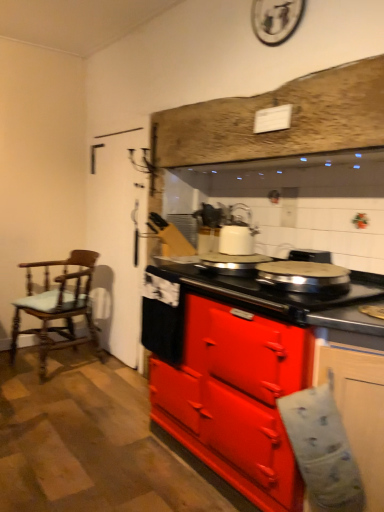
Locate an element on the screen. This screenshot has height=512, width=384. matte red stove at center, acting as the first cabinetry starting from the back is located at coordinates (236, 398).

This screenshot has height=512, width=384. What are the coordinates of `wooden chair with cushion at left` in the screenshot? It's located at (58, 306).

This screenshot has width=384, height=512. Describe the element at coordinates (359, 409) in the screenshot. I see `matte white cabinet at lower right, placed as the second cabinetry when sorted from back to front` at that location.

You are a GUI agent. You are given a task and a screenshot of the screen. Output one action in this format:
    pyautogui.click(x=<x>, y=<y>)
    Task: Click on the matte red stove at center, acting as the first cabinetry starting from the back
    
    Given the screenshot: What is the action you would take?
    pyautogui.click(x=236, y=398)

The width and height of the screenshot is (384, 512). What are the coordinates of `cabinetry above the matte white cabinet at lower right, which is the first cabinetry from front to back (from a real-world perspective)` in the screenshot? It's located at (236, 398).

Looking at this image, is matte white cabinet at lower right, placed as the second cabinetry when sorted from back to front, positioned with its back to matte red stove at center, acting as the first cabinetry starting from the back?

Yes.

Does point (379, 384) come behind point (259, 438)?

That is False.

From a real-world perspective, is matte white cabinet at lower right, placed as the second cabinetry when sorted from back to front, physically below matte red stove at center, acting as the first cabinetry starting from the back?

Yes.

From the image's perspective, is wooden chair with cushion at left located above matte red stove at center, acting as the first cabinetry starting from the back?

Indeed, from the image's perspective, wooden chair with cushion at left is shown above matte red stove at center, acting as the first cabinetry starting from the back.

Choose the correct answer: Is wooden chair with cushion at left inside matte red stove at center, positioned as the 2th cabinetry in front-to-back order, or outside it?

wooden chair with cushion at left lies outside matte red stove at center, positioned as the 2th cabinetry in front-to-back order.

Consider the image. In the image, is wooden chair with cushion at left positioned in front of or behind matte red stove at center, acting as the first cabinetry starting from the back?

wooden chair with cushion at left is behind matte red stove at center, acting as the first cabinetry starting from the back.

Would you say white glossy kettle at center is a long distance from matte white cabinet at lower right, placed as the second cabinetry when sorted from back to front?

Yes, white glossy kettle at center is far from matte white cabinet at lower right, placed as the second cabinetry when sorted from back to front.

From the image's perspective, which object appears higher, white glossy kettle at center or matte white cabinet at lower right, which is the first cabinetry from front to back?

From the image's view, white glossy kettle at center is above.

Is white glossy kettle at center bigger or smaller than matte white cabinet at lower right, placed as the second cabinetry when sorted from back to front?

Clearly, white glossy kettle at center is smaller in size than matte white cabinet at lower right, placed as the second cabinetry when sorted from back to front.

Considering the positions of objects white glossy kettle at center and matte white cabinet at lower right, which is the first cabinetry from front to back, in the image provided, who is behind, white glossy kettle at center or matte white cabinet at lower right, which is the first cabinetry from front to back,?

white glossy kettle at center is further from the camera.

Is the position of matte white cabinet at lower right, placed as the second cabinetry when sorted from back to front, more distant than that of white glossy kettle at center?

No, it is not.

From the image's perspective, does matte white cabinet at lower right, placed as the second cabinetry when sorted from back to front, appear higher than white glossy kettle at center?

Actually, matte white cabinet at lower right, placed as the second cabinetry when sorted from back to front, appears below white glossy kettle at center in the image.

Which of these two, matte white cabinet at lower right, placed as the second cabinetry when sorted from back to front, or white glossy kettle at center, is thinner?

white glossy kettle at center.

From a real-world perspective, is matte white cabinet at lower right, which is the first cabinetry from front to back, positioned above or below white glossy kettle at center?

From a real-world perspective, matte white cabinet at lower right, which is the first cabinetry from front to back, is physically below white glossy kettle at center.

From a real-world perspective, which object rests below the other?

In real-world perspective, matte white cabinet at lower right, which is the first cabinetry from front to back, is lower.

Considering the relative positions of matte red stove at center, positioned as the 2th cabinetry in front-to-back order, and matte white cabinet at lower right, which is the first cabinetry from front to back, in the image provided, is matte red stove at center, positioned as the 2th cabinetry in front-to-back order, to the left of matte white cabinet at lower right, which is the first cabinetry from front to back, from the viewer's perspective?

Correct, you'll find matte red stove at center, positioned as the 2th cabinetry in front-to-back order, to the left of matte white cabinet at lower right, which is the first cabinetry from front to back.

Consider the image. Can you tell me how much matte red stove at center, positioned as the 2th cabinetry in front-to-back order, and matte white cabinet at lower right, placed as the second cabinetry when sorted from back to front, differ in facing direction?

A: The facing directions of matte red stove at center, positioned as the 2th cabinetry in front-to-back order, and matte white cabinet at lower right, placed as the second cabinetry when sorted from back to front, are 28.6 degrees apart.

How much distance is there between white glossy kettle at center and wooden chair with cushion at left?

The distance of white glossy kettle at center from wooden chair with cushion at left is 1.45 meters.

In the scene shown: Is white glossy kettle at center in contact with wooden chair with cushion at left?

white glossy kettle at center is not next to wooden chair with cushion at left, and they're not touching.

Between white glossy kettle at center and wooden chair with cushion at left, which one has smaller width?

Thinner between the two is white glossy kettle at center.

Which is behind, point (248, 239) or point (80, 268)?

The point (80, 268) is farther.

In the image, is matte red stove at center, acting as the first cabinetry starting from the back, positioned in front of or behind wooden chair with cushion at left?

matte red stove at center, acting as the first cabinetry starting from the back, is in front of wooden chair with cushion at left.

From a real-world perspective, which is physically below, matte red stove at center, acting as the first cabinetry starting from the back, or wooden chair with cushion at left?

wooden chair with cushion at left.

Is there a large distance between matte red stove at center, positioned as the 2th cabinetry in front-to-back order, and wooden chair with cushion at left?

Absolutely, matte red stove at center, positioned as the 2th cabinetry in front-to-back order, is distant from wooden chair with cushion at left.

Measure the distance between matte red stove at center, acting as the first cabinetry starting from the back, and wooden chair with cushion at left.

matte red stove at center, acting as the first cabinetry starting from the back, is 1.50 meters from wooden chair with cushion at left.

Locate an element on the screen. The width and height of the screenshot is (384, 512). cabinetry behind the matte white cabinet at lower right, which is the first cabinetry from front to back is located at coordinates (236, 398).

Locate an element on the screen. the 1st cabinetry positioned below the wooden chair with cushion at left (from the image's perspective) is located at coordinates (236, 398).

Estimate the real-world distances between objects in this image. Which object is further from matte red stove at center, acting as the first cabinetry starting from the back, matte white cabinet at lower right, which is the first cabinetry from front to back, or wooden chair with cushion at left?

The object further to matte red stove at center, acting as the first cabinetry starting from the back, is wooden chair with cushion at left.

Which object lies nearer to the anchor point matte red stove at center, positioned as the 2th cabinetry in front-to-back order, white glossy kettle at center or wooden chair with cushion at left?

Among the two, white glossy kettle at center is located nearer to matte red stove at center, positioned as the 2th cabinetry in front-to-back order.

Estimate the real-world distances between objects in this image. Which object is closer to wooden chair with cushion at left, white glossy kettle at center or matte white cabinet at lower right, placed as the second cabinetry when sorted from back to front?

The object closer to wooden chair with cushion at left is white glossy kettle at center.

Based on their spatial positions, is white glossy kettle at center or matte red stove at center, acting as the first cabinetry starting from the back, closer to matte white cabinet at lower right, placed as the second cabinetry when sorted from back to front?

matte red stove at center, acting as the first cabinetry starting from the back.

Based on their spatial positions, is white glossy kettle at center or matte red stove at center, positioned as the 2th cabinetry in front-to-back order, further from wooden chair with cushion at left?

The object further to wooden chair with cushion at left is matte red stove at center, positioned as the 2th cabinetry in front-to-back order.

When comparing their distances from white glossy kettle at center, does matte red stove at center, acting as the first cabinetry starting from the back, or matte white cabinet at lower right, placed as the second cabinetry when sorted from back to front, seem closer?

Among the two, matte red stove at center, acting as the first cabinetry starting from the back, is located nearer to white glossy kettle at center.

Based on their spatial positions, is matte red stove at center, positioned as the 2th cabinetry in front-to-back order, or wooden chair with cushion at left further from matte white cabinet at lower right, which is the first cabinetry from front to back?

wooden chair with cushion at left is positioned further to the anchor matte white cabinet at lower right, which is the first cabinetry from front to back.

Looking at the image, which one is located closer to wooden chair with cushion at left, matte white cabinet at lower right, placed as the second cabinetry when sorted from back to front, or matte red stove at center, acting as the first cabinetry starting from the back?

matte red stove at center, acting as the first cabinetry starting from the back, is closer to wooden chair with cushion at left.

This screenshot has height=512, width=384. I want to click on cabinetry between matte white cabinet at lower right, which is the first cabinetry from front to back, and wooden chair with cushion at left from front to back, so [236, 398].

Where is `kitchen appliance between wooden chair with cushion at left and matte red stove at center, positioned as the 2th cabinetry in front-to-back order`? kitchen appliance between wooden chair with cushion at left and matte red stove at center, positioned as the 2th cabinetry in front-to-back order is located at coordinates (237, 230).

I want to click on kitchen appliance located between wooden chair with cushion at left and matte white cabinet at lower right, which is the first cabinetry from front to back, in the left-right direction, so click(237, 230).

Where is `cabinetry that lies between white glossy kettle at center and matte white cabinet at lower right, which is the first cabinetry from front to back, from top to bottom`? The width and height of the screenshot is (384, 512). cabinetry that lies between white glossy kettle at center and matte white cabinet at lower right, which is the first cabinetry from front to back, from top to bottom is located at coordinates (236, 398).